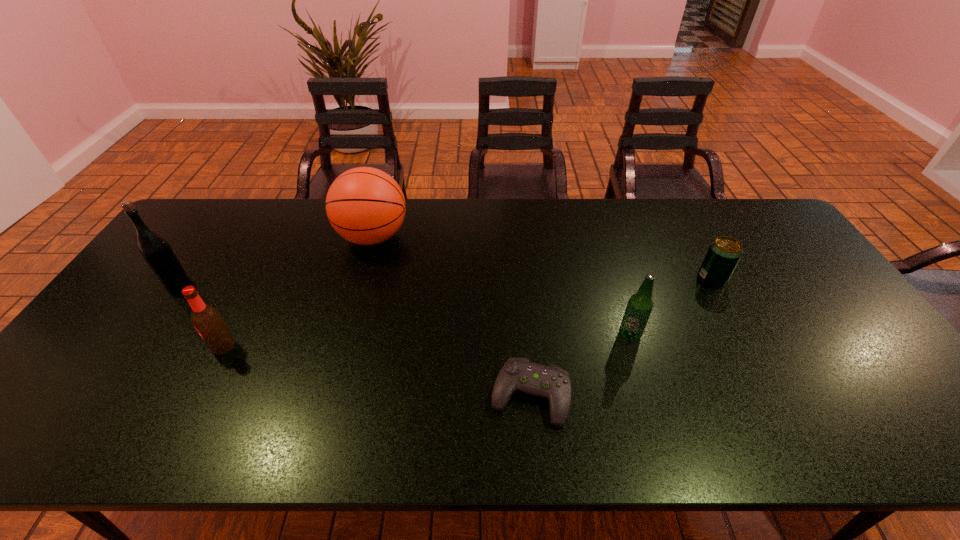
In the image, there is a desktop. At what (x,y) coordinates should I click in order to perform the action: click on vacant space at the near edge. Please return your answer as a coordinate pair (x, y). Looking at the image, I should click on click(x=308, y=438).

Image resolution: width=960 pixels, height=540 pixels. In the image, there is a desktop. In order to click on vacant space at the right edge in this screenshot , I will do `click(765, 245)`.

Where is `free point between the third object from left to right and the rightmost object`? The height and width of the screenshot is (540, 960). free point between the third object from left to right and the rightmost object is located at coordinates (542, 257).

Locate an element on the screen. The image size is (960, 540). vacant space that is in between the fourth object from right to left and the fifth tallest object is located at coordinates (542, 257).

Locate an element on the screen. The image size is (960, 540). vacant space in between the rightmost object and the rightmost beer bottle is located at coordinates (671, 306).

Locate an element on the screen. blank region between the second object from left to right and the nearest object is located at coordinates (377, 371).

Where is `free spot between the rightmost beer bottle and the fifth object from right to left`? Image resolution: width=960 pixels, height=540 pixels. free spot between the rightmost beer bottle and the fifth object from right to left is located at coordinates (426, 341).

Locate an element on the screen. Image resolution: width=960 pixels, height=540 pixels. vacant area that lies between the rightmost beer bottle and the rightmost object is located at coordinates (671, 306).

At what (x,y) coordinates should I click in order to perform the action: click on empty location between the second beer bottle from right to left and the beer can. Please return your answer as a coordinate pair (x, y). This screenshot has width=960, height=540. Looking at the image, I should click on (468, 312).

Point out which object is positioned as the second nearest to the leftmost object. Please provide its 2D coordinates. Your answer should be formatted as a tuple, i.e. [(x, y)], where the tuple contains the x and y coordinates of a point satisfying the conditions above.

[(366, 206)]